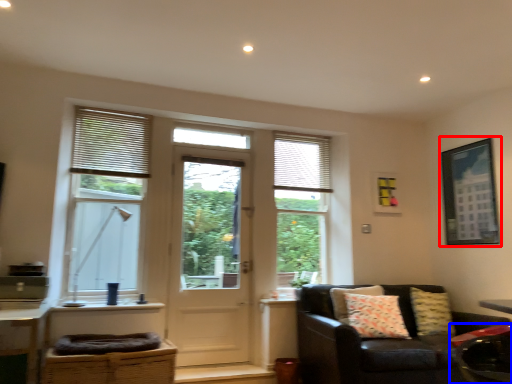
Question: Which object appears closest to the camera in this image, picture frame (highlighted by a red box) or swivel chair (highlighted by a blue box)?

Choices:
 (A) picture frame
 (B) swivel chair

Answer: (B)